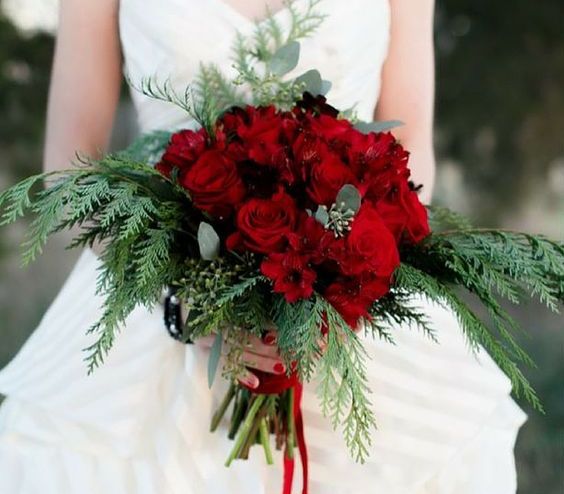
Locate an element on the screen. green and white plant is located at coordinates (214, 283).